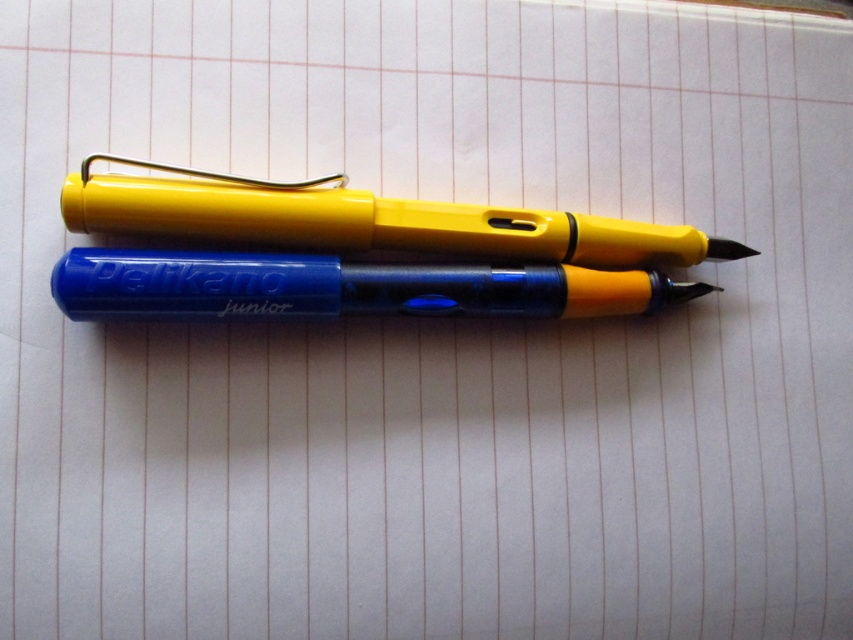
Is point (193, 236) closer to viewer compared to point (225, 305)?

No, (193, 236) is behind (225, 305).

Find the location of a particular element. yellow plastic pen at center is located at coordinates (366, 220).

Where is `yellow plastic pen at center`? The image size is (853, 640). yellow plastic pen at center is located at coordinates (366, 220).

Is yellow plastic pen at center shorter than blue translucent pen at center?

Incorrect, yellow plastic pen at center's height does not fall short of blue translucent pen at center's.

The width and height of the screenshot is (853, 640). Find the location of `yellow plastic pen at center`. yellow plastic pen at center is located at coordinates (366, 220).

Describe the element at coordinates (366, 220) in the screenshot. This screenshot has width=853, height=640. I see `yellow plastic pen at center` at that location.

Identify the location of yellow plastic pen at center. Image resolution: width=853 pixels, height=640 pixels. (366, 220).

Between blue translucent pen at center and blue plastic pen at center, which one appears on the left side from the viewer's perspective?

blue plastic pen at center

Can you confirm if blue translucent pen at center is taller than blue plastic pen at center?

Indeed, blue translucent pen at center has a greater height compared to blue plastic pen at center.

Is point (706, 291) positioned before point (283, 301)?

No, (706, 291) is behind (283, 301).

Find the location of `blue translucent pen at center`. blue translucent pen at center is located at coordinates [x=346, y=285].